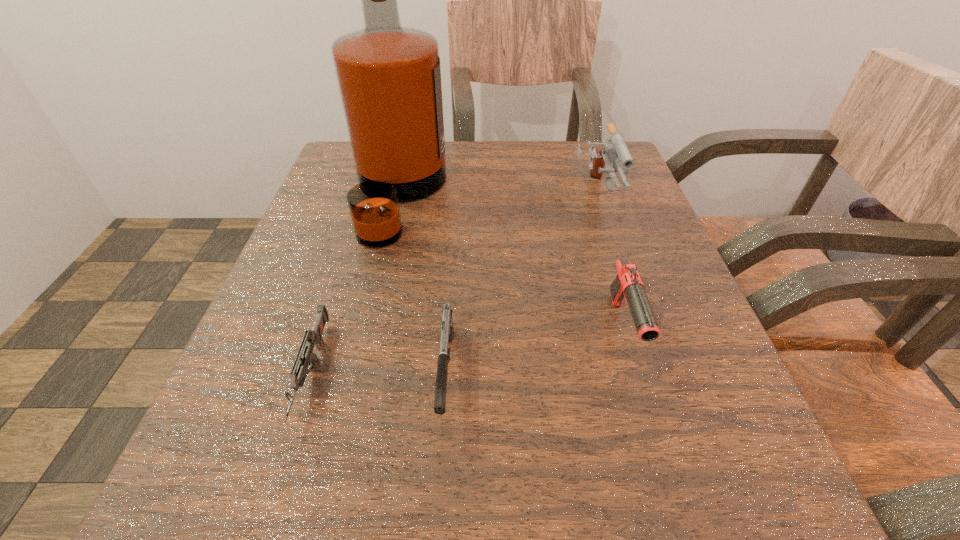
Find the location of `vacant space that satisfies the following two spatial constraints: 1. at the barrel end of the tallest gun; 2. on the front label of the liquor`. vacant space that satisfies the following two spatial constraints: 1. at the barrel end of the tallest gun; 2. on the front label of the liquor is located at coordinates (596, 197).